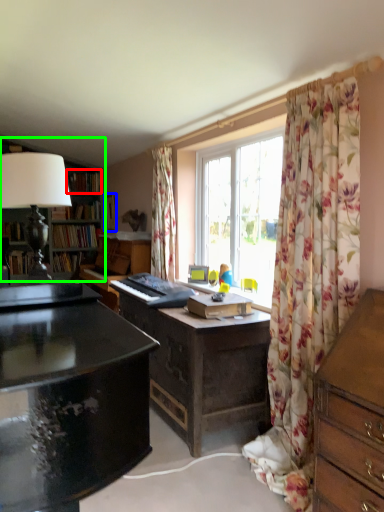
Question: Estimate the real-world distances between objects in this image. Which object is farther from book (highlighted by a red box), picture frame (highlighted by a blue box) or bookcase (highlighted by a green box)?

Choices:
 (A) picture frame
 (B) bookcase

Answer: (B)